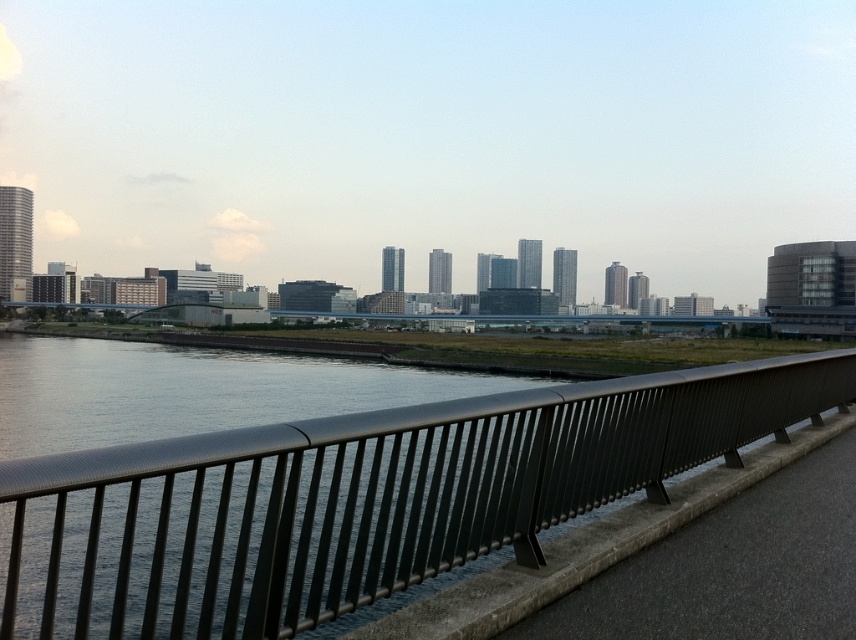
Does metallic gray railing at center appear on the left side of black metal railing at center?

Indeed, metallic gray railing at center is positioned on the left side of black metal railing at center.

Where is `metallic gray railing at center`? This screenshot has height=640, width=856. metallic gray railing at center is located at coordinates (360, 499).

Identify the location of metallic gray railing at center. The width and height of the screenshot is (856, 640). (360, 499).